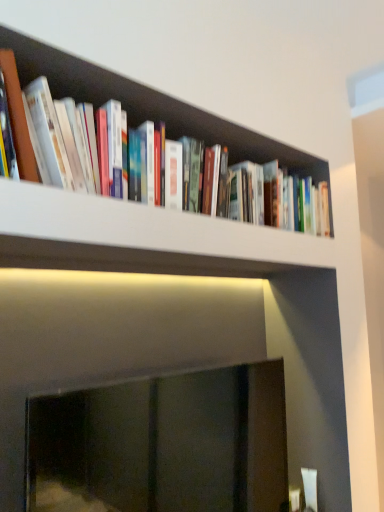
This screenshot has height=512, width=384. In order to click on free location above hardcover books at upper center (from a real-world perspective) in this screenshot , I will do `click(211, 135)`.